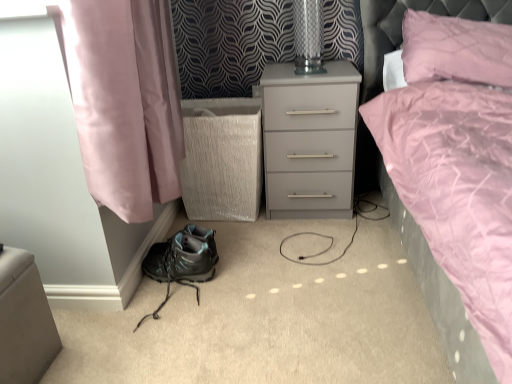
Question: In terms of size, does transparent glass table lamp at upper center appear bigger or smaller than matte black hiking boot at lower left?

Choices:
 (A) small
 (B) big

Answer: (B)

Question: From the image's perspective, is transparent glass table lamp at upper center located above or below matte black hiking boot at lower left?

Choices:
 (A) below
 (B) above

Answer: (B)

Question: Which is nearer to the matte black hiking boot at lower left?

Choices:
 (A) pink quilted pillow at upper right
 (B) matte gray nightstand at center
 (C) matte black hiking boot at lower left
 (D) transparent glass table lamp at upper center

Answer: (C)

Question: Which object is positioned farthest from the matte black hiking boot at lower left?

Choices:
 (A) transparent glass table lamp at upper center
 (B) pink quilted pillow at upper right
 (C) matte black hiking boot at lower left
 (D) matte gray nightstand at center

Answer: (B)